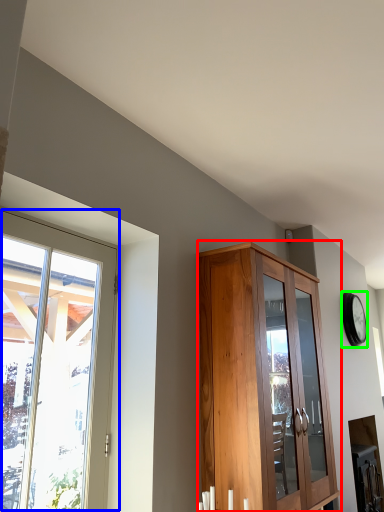
Question: Which object is positioned closest to cupboard (highlighted by a red box)? Select from window (highlighted by a blue box) and clock (highlighted by a green box).

Choices:
 (A) window
 (B) clock

Answer: (A)